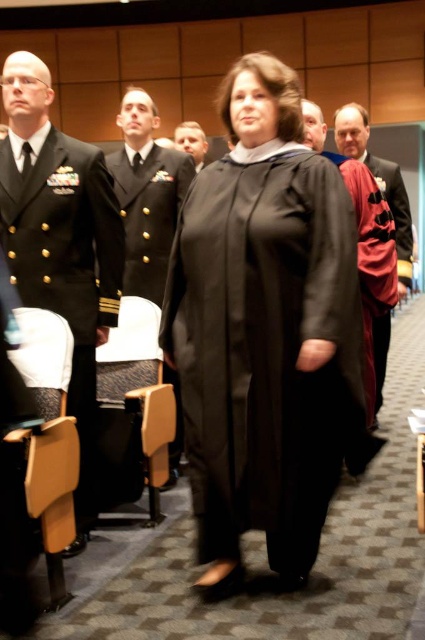
Question: Can you confirm if wooden grain chair at center is bigger than tan leather chair at lower left?

Choices:
 (A) yes
 (B) no

Answer: (A)

Question: Among these points, which one is farthest from the camera?

Choices:
 (A) (17, 141)
 (B) (125, 321)

Answer: (B)

Question: In this image, where is dark navy uniform at left located relative to red velvet scarf at right?

Choices:
 (A) below
 (B) above

Answer: (A)

Question: Among these objects, which one is nearest to the camera?

Choices:
 (A) tan leather chair at lower left
 (B) velvet burgundy robe at center
 (C) red velvet scarf at right

Answer: (A)

Question: Which object appears closest to the camera in this image?

Choices:
 (A) matte black gown at center
 (B) matte black uniform at center
 (C) wooden grain chair at center
 (D) shiny black uniform at center

Answer: (A)

Question: Can you confirm if velvet burgundy robe at center is smaller than matte black uniform at center?

Choices:
 (A) no
 (B) yes

Answer: (A)